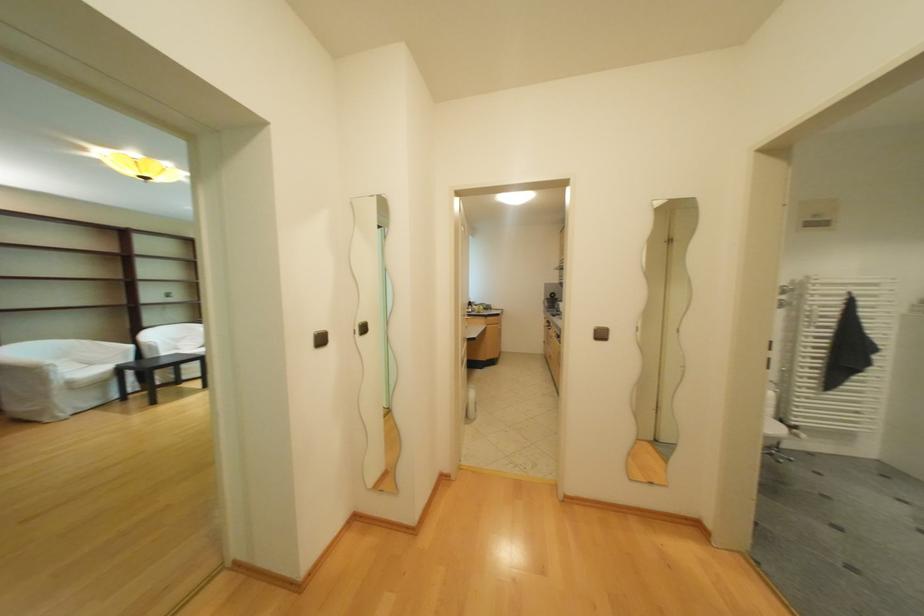
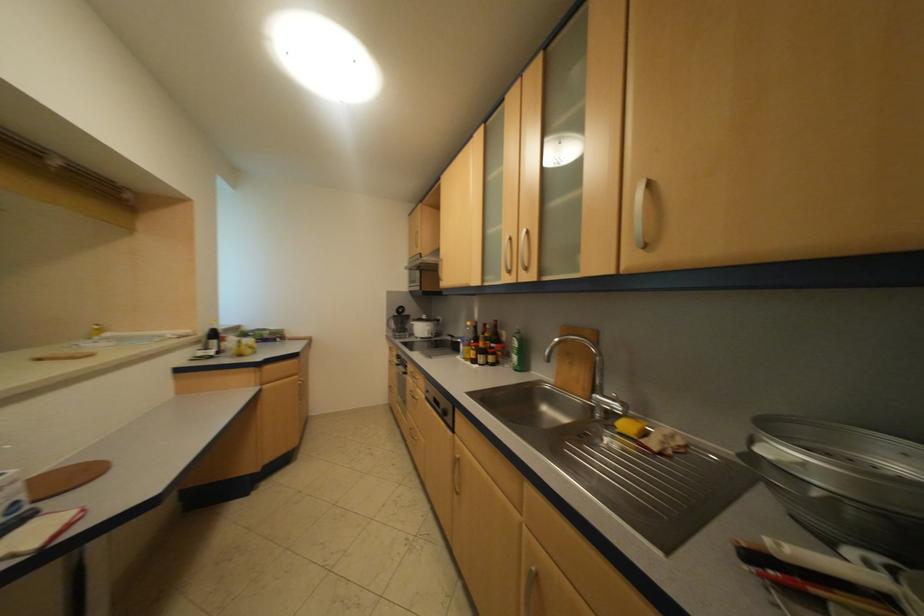
Where in the second image is the point corresponding to point 479,304 from the first image?

(214, 334)